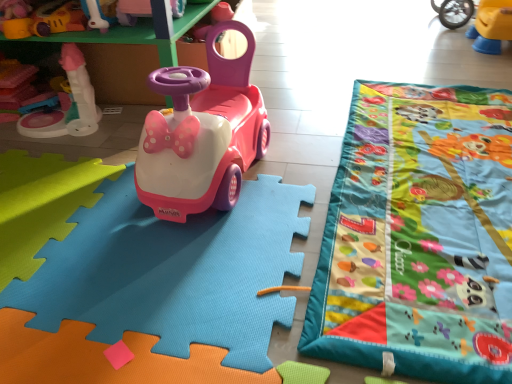
Question: Would you say pink plastic toy car at center is to the left or to the right of matte plastic toy at left, the fourth toy when ordered from top to bottom, in the picture?

Choices:
 (A) left
 (B) right

Answer: (B)

Question: Considering their positions, is pink plastic toy car at center located in front of or behind matte plastic toy at left, placed as the 2th toy when sorted from bottom to top?

Choices:
 (A) front
 (B) behind

Answer: (A)

Question: Estimate the real-world distances between objects in this image. Which object is closer to the matte plastic toy at left, placed as the 2th toy when sorted from bottom to top?

Choices:
 (A) multicolored fabric play mat at right
 (B) matte plastic toy car at upper center, positioned as the 4th toy in bottom-to-top order
 (C) pink plastic toy car at center, the 1th toy viewed from the top
 (D) matte plastic toy at upper left, acting as the 3th toy starting from the bottom
 (E) pink plastic toy car at center

Answer: (D)

Question: Which object is the closest to the matte plastic toy at left, the fourth toy when ordered from top to bottom?

Choices:
 (A) pink plastic car at center, the 1th toy ordered from the bottom
 (B) matte plastic toy at upper left, the third toy from the top
 (C) matte plastic toy car at upper center, the second toy positioned from the top
 (D) pink plastic toy car at center, the 1th toy viewed from the top
 (E) multicolored fabric play mat at right

Answer: (B)